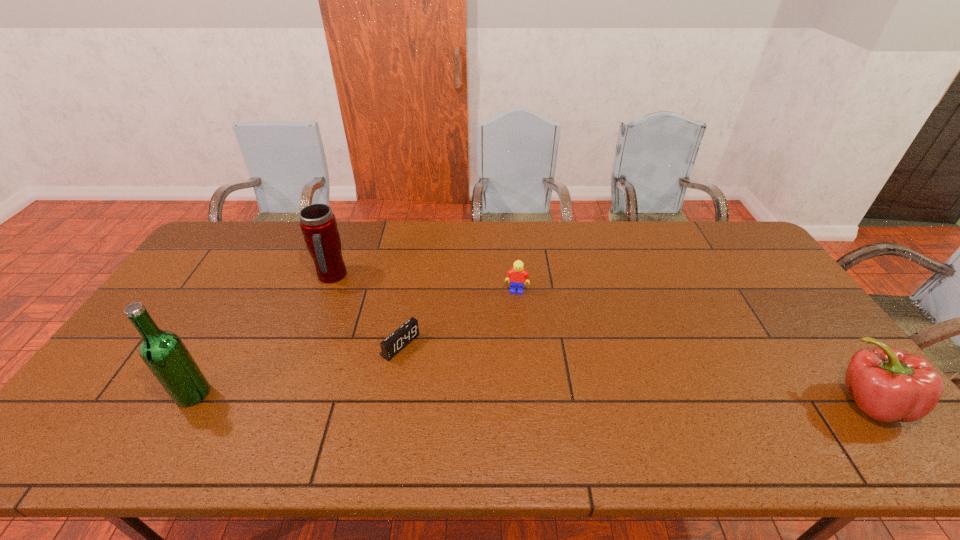
Find the location of a particular element. The width and height of the screenshot is (960, 540). the leftmost object is located at coordinates coord(164,353).

Where is `beer bottle`? beer bottle is located at coordinates (164, 353).

Image resolution: width=960 pixels, height=540 pixels. I want to click on pepper, so click(887, 384).

The height and width of the screenshot is (540, 960). I want to click on the third shortest object, so click(x=887, y=384).

The image size is (960, 540). I want to click on the third nearest object, so click(392, 345).

At what (x,y) coordinates should I click in order to perform the action: click on the shortest object. Please return your answer as a coordinate pair (x, y). Image resolution: width=960 pixels, height=540 pixels. Looking at the image, I should click on (392, 345).

Where is `the fourth shortest object`? the fourth shortest object is located at coordinates (318, 224).

The image size is (960, 540). In order to click on the fourth object from right to left in this screenshot , I will do `click(318, 224)`.

At what (x,y) coordinates should I click in order to perform the action: click on the second shortest object. Please return your answer as a coordinate pair (x, y). Image resolution: width=960 pixels, height=540 pixels. Looking at the image, I should click on (516, 276).

Identify the location of Lego. The image size is (960, 540). (516, 276).